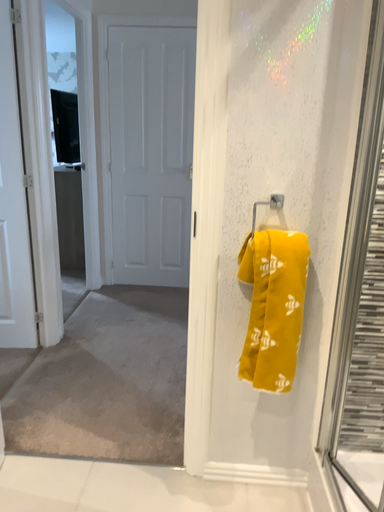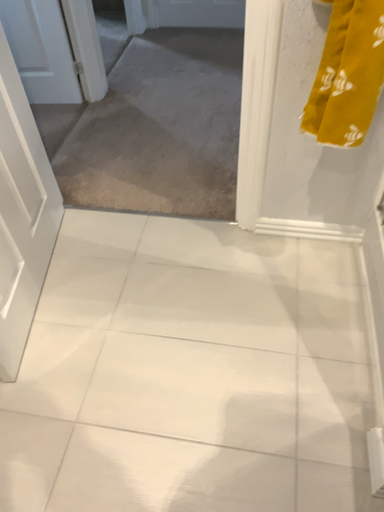
Question: How did the camera likely rotate when shooting the video?

Choices:
 (A) rotated downward
 (B) rotated upward

Answer: (A)